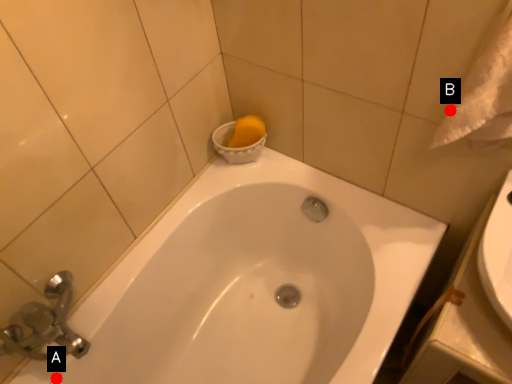
Question: Two points are circled on the image, labeled by A and B beside each circle. Which point is further to the camera?

Choices:
 (A) A is further
 (B) B is further

Answer: (A)